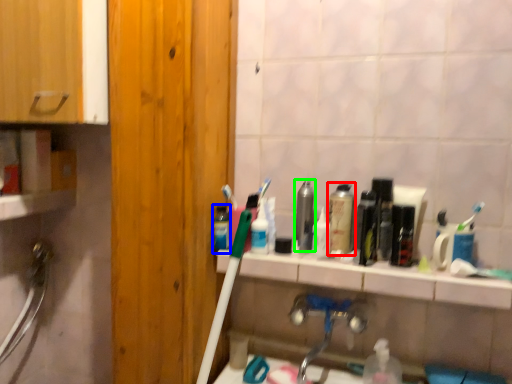
Question: Which object is the closest to the mouthwash (highlighted by a red box)? Choose among these: mouthwash (highlighted by a blue box) or mouthwash (highlighted by a green box).

Choices:
 (A) mouthwash
 (B) mouthwash

Answer: (B)